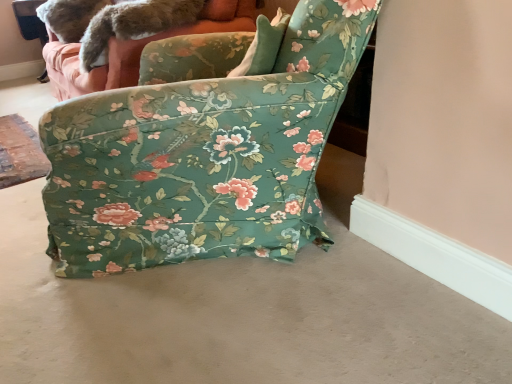
Question: From a real-world perspective, relative to fuzzy fur tail at upper left, is floral fabric couch at upper center vertically above or below?

Choices:
 (A) above
 (B) below

Answer: (B)

Question: Is floral fabric couch at upper center spatially inside fuzzy fur tail at upper left, or outside of it?

Choices:
 (A) inside
 (B) outside

Answer: (B)

Question: Which of these objects is positioned closest to the floral fabric chair at center?

Choices:
 (A) fuzzy fur tail at upper left
 (B) floral fabric couch at upper center
 (C) beige carpet at lower center

Answer: (C)

Question: Which object is the closest to the floral fabric couch at upper center?

Choices:
 (A) beige carpet at lower center
 (B) floral fabric chair at center
 (C) fuzzy fur tail at upper left

Answer: (C)